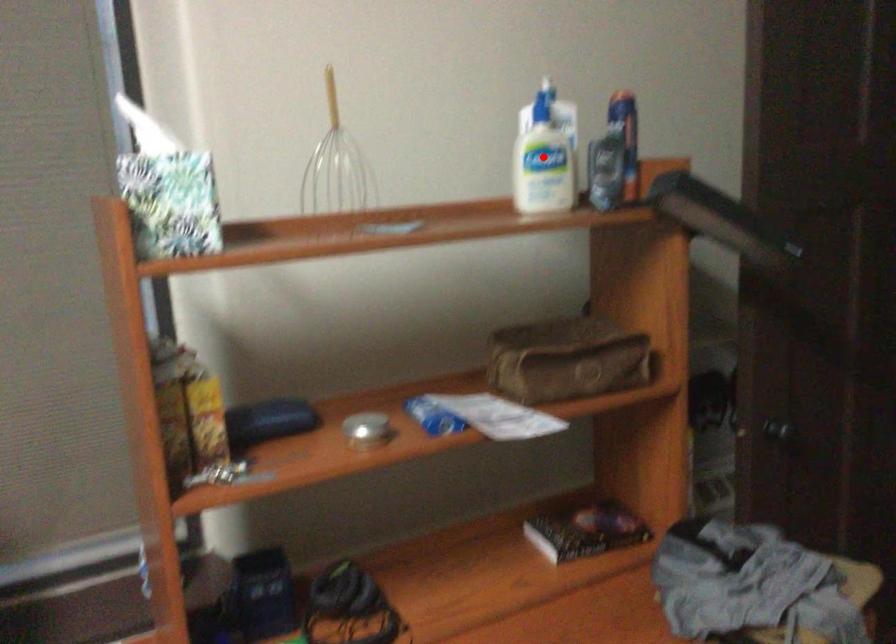
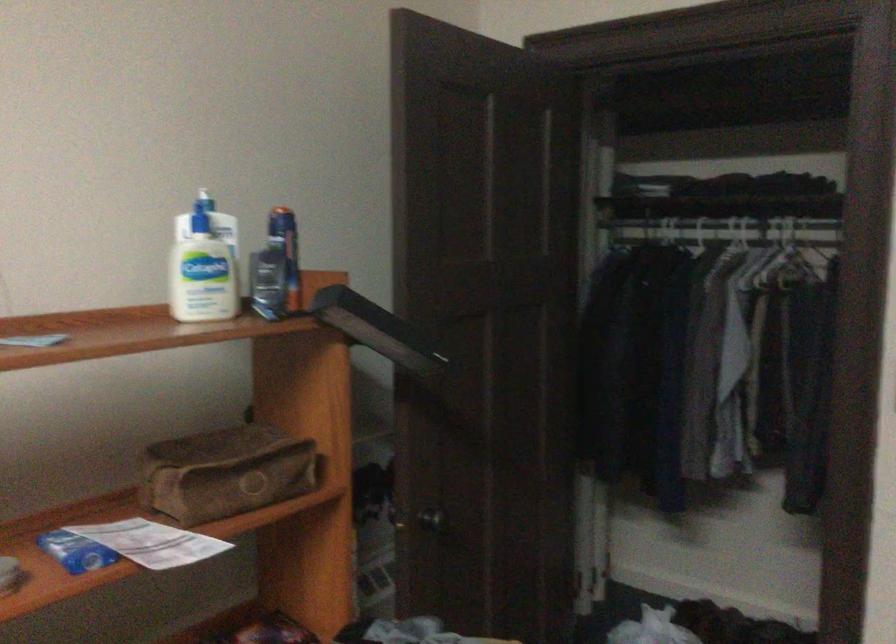
Question: I am providing you with two images of the same scene from different viewpoints. A red point is marked on the first image. At the location where the point appears in image 1, is it still visible in image 2?

Choices:
 (A) Yes
 (B) No

Answer: (A)